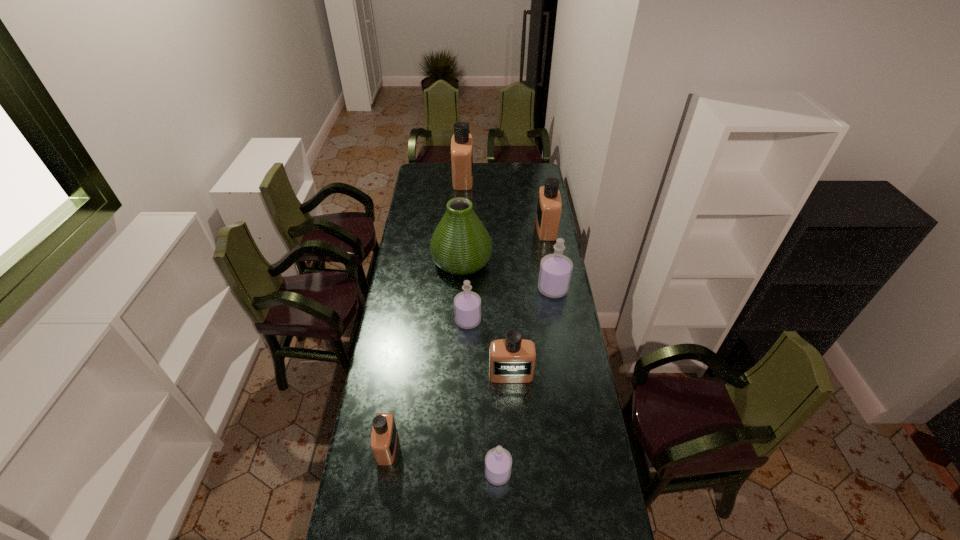
Identify the location of the third beige perfume from right to left. The height and width of the screenshot is (540, 960). (462, 142).

Image resolution: width=960 pixels, height=540 pixels. Identify the location of the farthest object. (462, 142).

Locate an element on the screen. The height and width of the screenshot is (540, 960). vase is located at coordinates (460, 245).

Locate an element on the screen. The width and height of the screenshot is (960, 540). the rightmost beige perfume is located at coordinates (549, 206).

Locate an element on the screen. The width and height of the screenshot is (960, 540). the seventh nearest object is located at coordinates (549, 206).

Find the location of a particular element. Image resolution: width=960 pixels, height=540 pixels. the fifth nearest perfume is located at coordinates (555, 273).

At what (x,y) coordinates should I click in order to perform the action: click on the biggest purple perfume. Please return your answer as a coordinate pair (x, y). The height and width of the screenshot is (540, 960). Looking at the image, I should click on (555, 273).

Image resolution: width=960 pixels, height=540 pixels. Find the location of `the second biggest purple perfume`. the second biggest purple perfume is located at coordinates (467, 305).

This screenshot has width=960, height=540. Find the location of `the leftmost purple perfume`. the leftmost purple perfume is located at coordinates (467, 305).

What are the coordinates of `the third nearest object` in the screenshot? It's located at (512, 360).